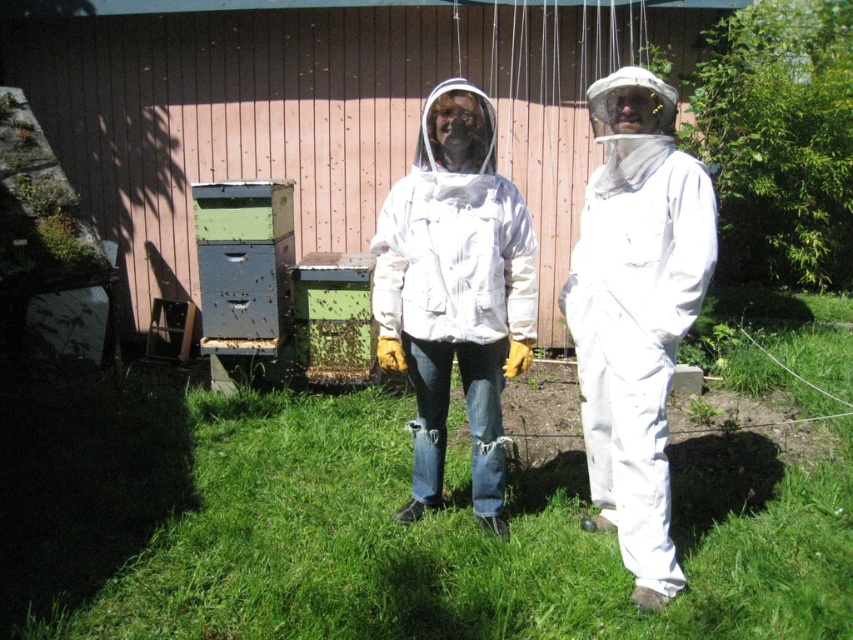
Question: Does green painted wooden beehive at center appear under green wooden beehive at center?

Choices:
 (A) yes
 (B) no

Answer: (B)

Question: Which point is farther from the camera taking this photo?

Choices:
 (A) (312, 308)
 (B) (219, 269)
 (C) (621, 278)

Answer: (A)

Question: Among these objects, which one is farthest from the camera?

Choices:
 (A) white matte bee suit at center
 (B) white fabric bee suit at center
 (C) green wooden beehive at center
 (D) white matte beekeeping suit at center

Answer: (C)

Question: Where is white matte beekeeping suit at center located in relation to green painted wooden beehive at center in the image?

Choices:
 (A) above
 (B) below

Answer: (B)

Question: Which object appears closest to the camera in this image?

Choices:
 (A) green painted wooden beehive at center
 (B) white fabric bee suit at center
 (C) white matte beekeeping suit at center

Answer: (B)

Question: Observing the image, what is the correct spatial positioning of white matte bee suit at center in reference to green painted wooden beehive at center?

Choices:
 (A) left
 (B) right

Answer: (B)